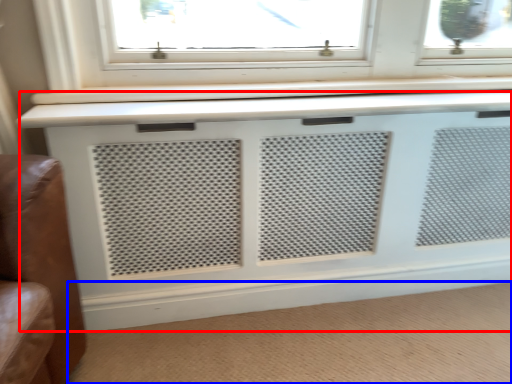
Question: Which point is closer to the camera, air conditioning (highlighted by a red box) or plain (highlighted by a blue box)?

Choices:
 (A) air conditioning
 (B) plain

Answer: (B)